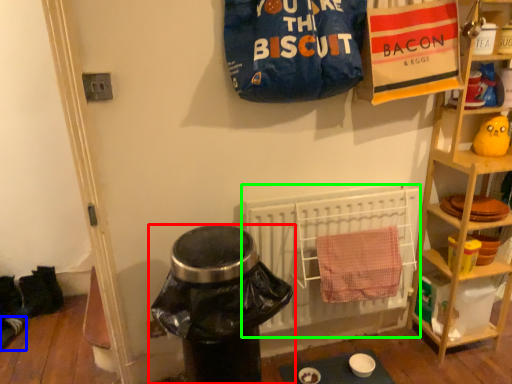
Question: Which object is positioned farthest from trash bin/can (highlighted by a red box)? Select from footwear (highlighted by a blue box) and radiator (highlighted by a green box).

Choices:
 (A) footwear
 (B) radiator

Answer: (A)